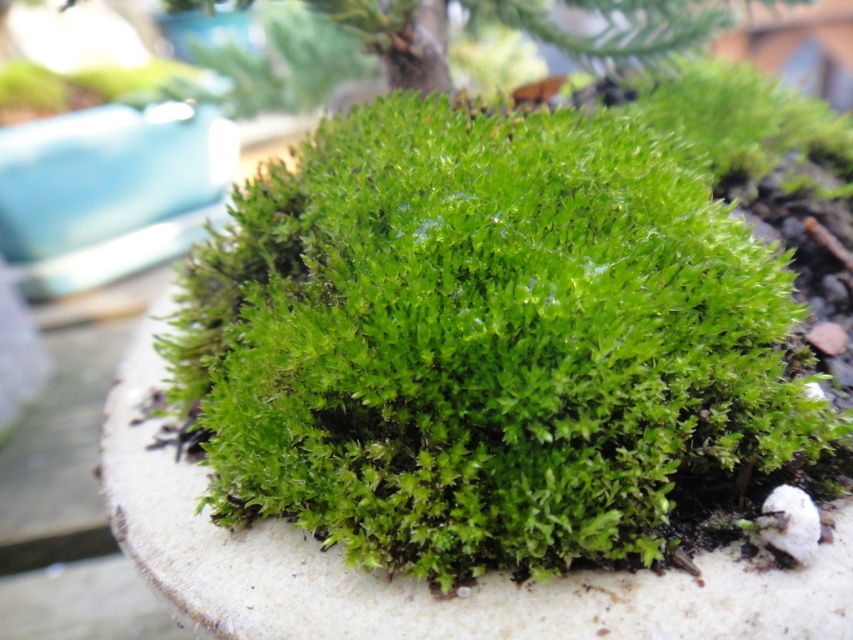
You are a gardener observing the green fuzzy moss at center and the green leafy tree at upper center in the image. Which object is taller?

The green fuzzy moss at center is taller than the green leafy tree at upper center according to the description.

In the scene shown: You are a photographer trying to focus on the vibrant green moss plant in the image. You notice two points marked in the scene. Which of the two points, point (x=611, y=282) or point (x=426, y=42), is closer to your camera lens?

Point (x=611, y=282) is closer to the camera lens than point (x=426, y=42).